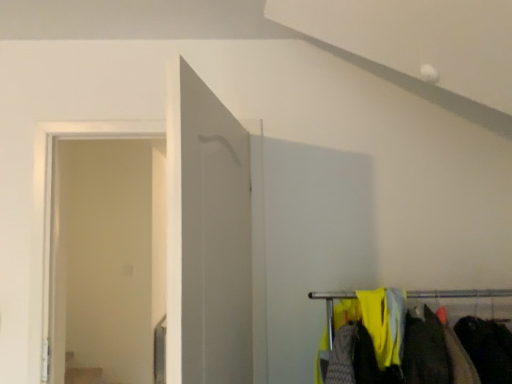
Question: Is transparent glass door at left positioned in front of dark gray fabric at lower right?

Choices:
 (A) yes
 (B) no

Answer: (B)

Question: From the image's perspective, would you say transparent glass door at left is shown under dark gray fabric at lower right?

Choices:
 (A) no
 (B) yes

Answer: (A)

Question: From the image's perspective, is transparent glass door at left on dark gray fabric at lower right?

Choices:
 (A) yes
 (B) no

Answer: (A)

Question: Can you confirm if transparent glass door at left is taller than dark gray fabric at lower right?

Choices:
 (A) no
 (B) yes

Answer: (B)

Question: Could dark gray fabric at lower right be considered to be inside transparent glass door at left?

Choices:
 (A) no
 (B) yes

Answer: (A)

Question: Is transparent glass door at left in front of or behind dark gray fabric at lower right in the image?

Choices:
 (A) behind
 (B) front

Answer: (A)

Question: Based on their positions, is transparent glass door at left located to the left or right of dark gray fabric at lower right?

Choices:
 (A) right
 (B) left

Answer: (B)

Question: Considering the positions of point (146, 225) and point (473, 334), is point (146, 225) closer or farther from the camera than point (473, 334)?

Choices:
 (A) closer
 (B) farther

Answer: (B)

Question: From a real-world perspective, is transparent glass door at left above or below dark gray fabric at lower right?

Choices:
 (A) below
 (B) above

Answer: (B)

Question: Considering the positions of white glossy door at center and dark gray fabric at lower right in the image, is white glossy door at center wider or thinner than dark gray fabric at lower right?

Choices:
 (A) wide
 (B) thin

Answer: (B)

Question: Do you think white glossy door at center is within dark gray fabric at lower right, or outside of it?

Choices:
 (A) outside
 (B) inside

Answer: (A)

Question: From the image's perspective, is white glossy door at center positioned above or below dark gray fabric at lower right?

Choices:
 (A) below
 (B) above

Answer: (B)

Question: In the image, is white glossy door at center positioned in front of or behind dark gray fabric at lower right?

Choices:
 (A) behind
 (B) front

Answer: (B)

Question: Based on their positions, is transparent glass door at left located to the left or right of white glossy door at center?

Choices:
 (A) right
 (B) left

Answer: (B)

Question: Considering the positions of point (139, 153) and point (230, 210), is point (139, 153) closer or farther from the camera than point (230, 210)?

Choices:
 (A) closer
 (B) farther

Answer: (B)